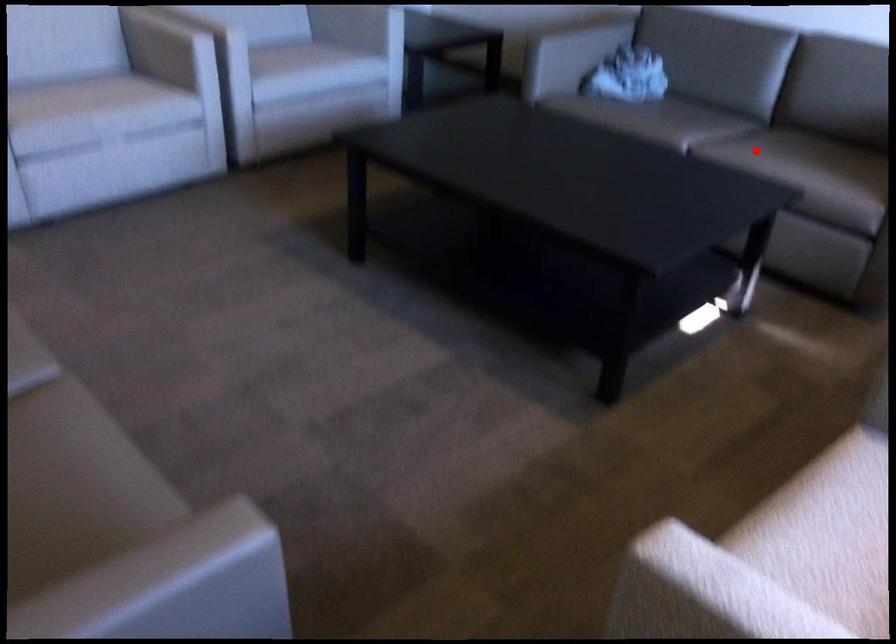
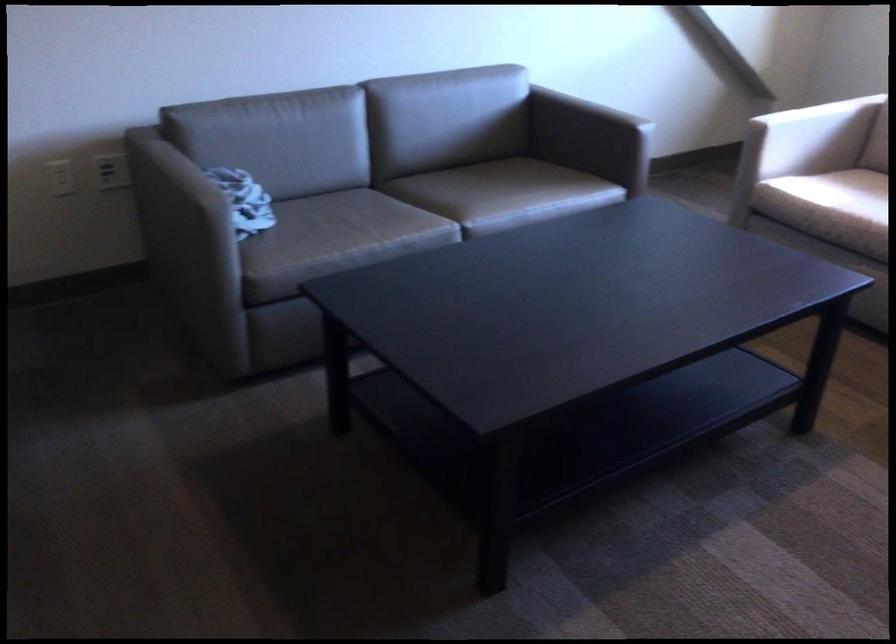
Locate, in the second image, the point that corresponds to the highlighted location in the first image.

(489, 194)